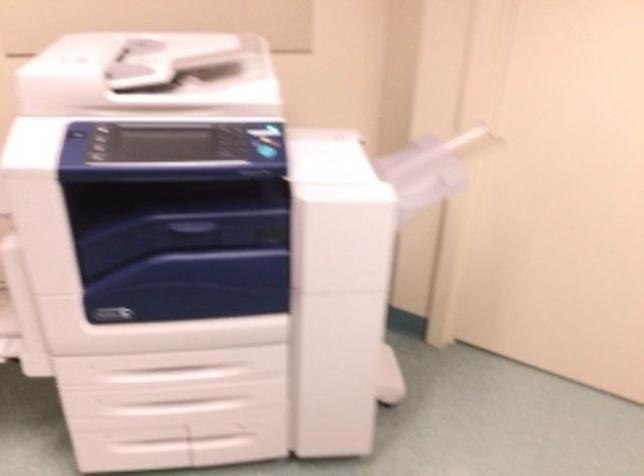
Describe the element at coordinates (122, 54) in the screenshot. The image size is (644, 476). I see `a scanner lid handle` at that location.